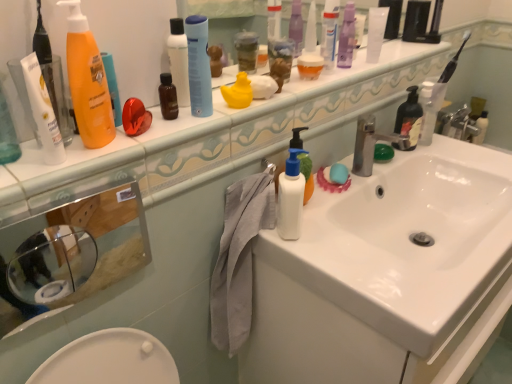
Where is `free space in front of translucent plastic bottle at upper right, placed as the third cleaning product when sorted from front to back`? Image resolution: width=512 pixels, height=384 pixels. free space in front of translucent plastic bottle at upper right, placed as the third cleaning product when sorted from front to back is located at coordinates (445, 155).